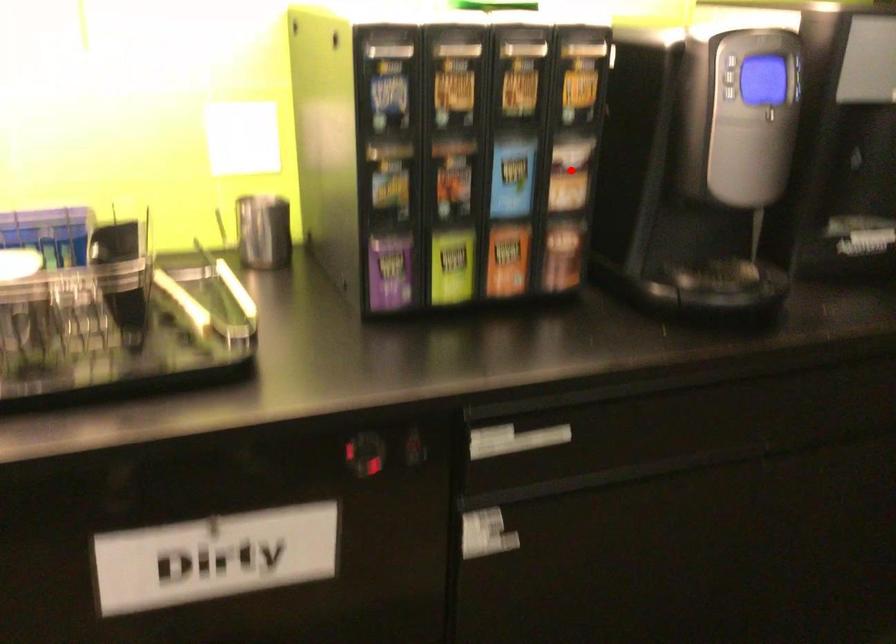
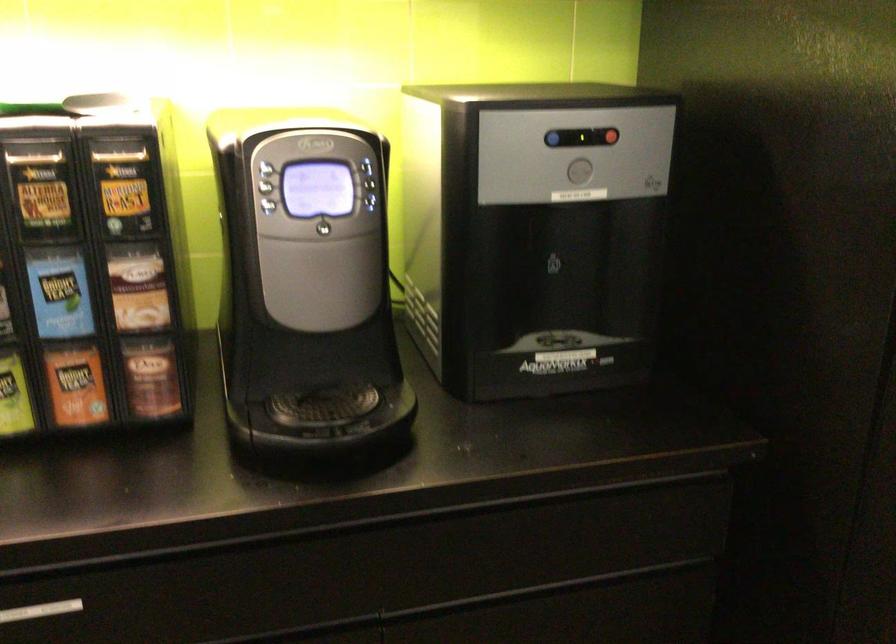
Where in the second image is the point corresponding to the highlighted location from the first image?

(138, 287)